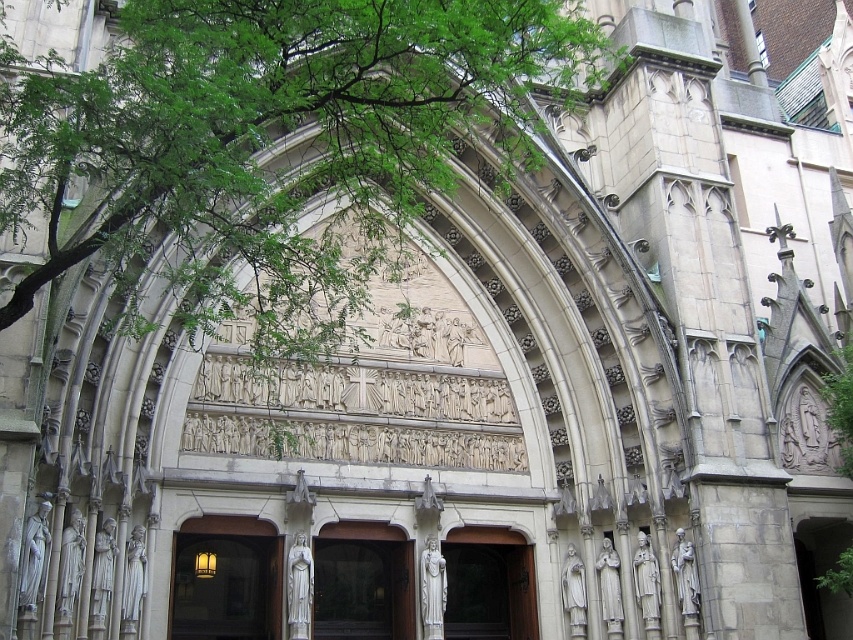
Can you confirm if smooth stone archway at center is thinner than white stone arch at center?

No, smooth stone archway at center is not thinner than white stone arch at center.

Is point (316, 621) closer to camera compared to point (480, 572)?

That is True.

Where is `smooth stone archway at center`? smooth stone archway at center is located at coordinates (363, 582).

Which is in front, point (431, 8) or point (496, 563)?

Point (431, 8) is in front.

Is point (48, 109) behind point (474, 556)?

No, (48, 109) is closer to viewer.

Locate an element on the screen. The image size is (853, 640). green leafy tree at upper left is located at coordinates (268, 147).

What do you see at coordinates (268, 147) in the screenshot? This screenshot has height=640, width=853. I see `green leafy tree at upper left` at bounding box center [268, 147].

Between green leafy tree at upper left and smooth stone archway at center, which one has less height?

smooth stone archway at center is shorter.

Looking at this image, who is more forward, (347, 234) or (390, 634)?

Point (390, 634)

You are a GUI agent. You are given a task and a screenshot of the screen. Output one action in this format:
    pyautogui.click(x=<x>, y=<y>)
    Task: Click on the green leafy tree at upper left
    This screenshot has height=640, width=853.
    Given the screenshot: What is the action you would take?
    pyautogui.click(x=268, y=147)